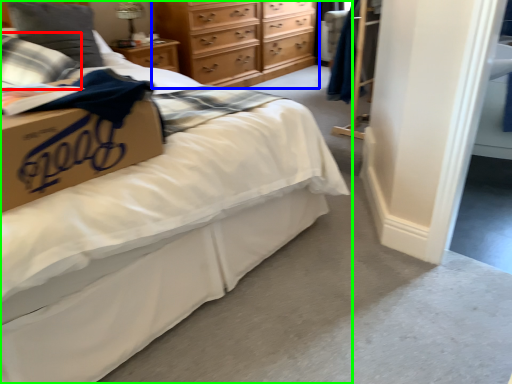
Question: Which object is positioned farthest from pillow (highlighted by a red box)? Select from chest of drawers (highlighted by a blue box) and bed (highlighted by a green box).

Choices:
 (A) chest of drawers
 (B) bed

Answer: (A)